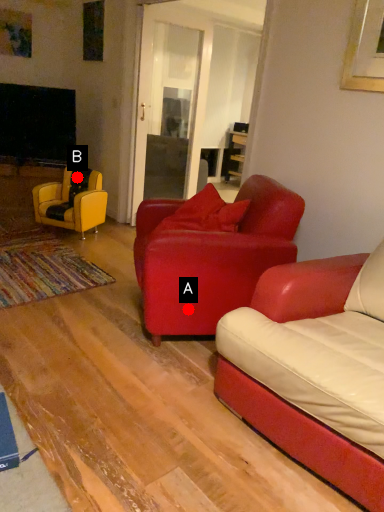
Question: Two points are circled on the image, labeled by A and B beside each circle. Which point appears closest to the camera in this image?

Choices:
 (A) A is closer
 (B) B is closer

Answer: (A)